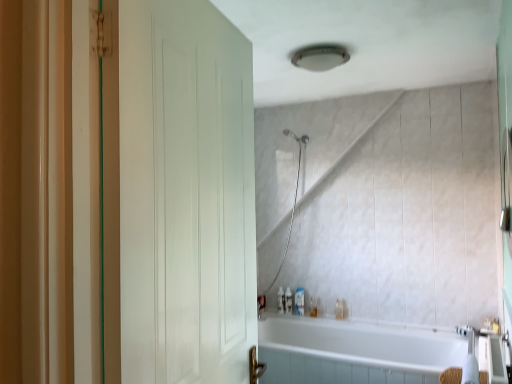
The image size is (512, 384). In order to click on vacant area that lies between translucent plastic soap dispenser at lower center, placed as the fifth toiletry when sorted from right to left, and translucent plastic bottle at lower center, placed as the first toiletry when sorted from left to right in this screenshot , I will do `click(271, 311)`.